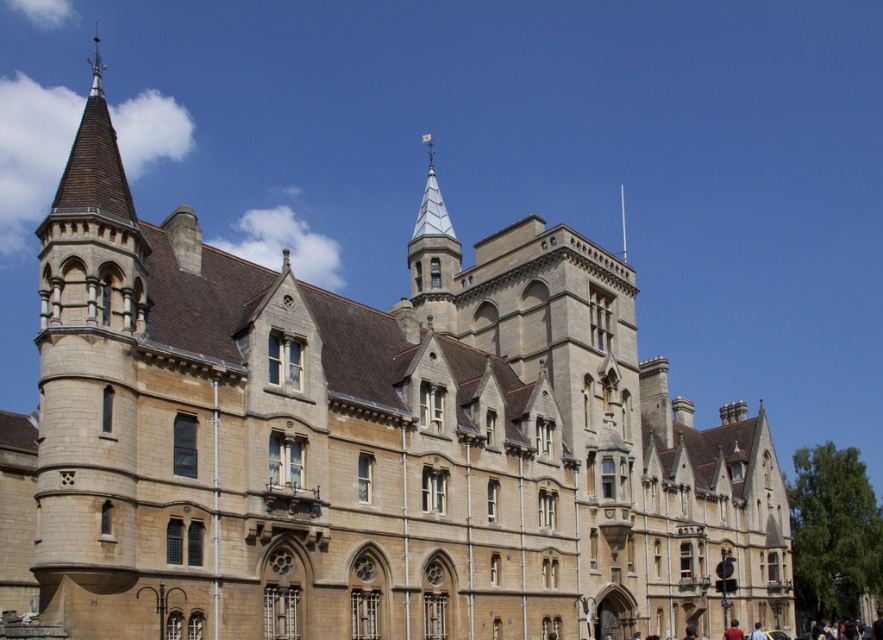
Question: Among these points, which one is nearest to the camera?

Choices:
 (A) (425, 198)
 (B) (730, 637)
 (C) (759, 637)

Answer: (C)

Question: Does red fabric person at lower right have a smaller size compared to blurred yellow shirt at lower right?

Choices:
 (A) no
 (B) yes

Answer: (B)

Question: Does white glass spire at upper center have a lesser width compared to red fabric person at lower right?

Choices:
 (A) no
 (B) yes

Answer: (A)

Question: Is red fabric person at lower right below blurred yellow shirt at lower right?

Choices:
 (A) yes
 (B) no

Answer: (B)

Question: Which point is closer to the camera taking this photo?

Choices:
 (A) (738, 634)
 (B) (435, 276)

Answer: (A)

Question: Which of the following is the closest to the observer?

Choices:
 (A) white glass spire at upper center
 (B) red fabric person at lower right
 (C) blurred yellow shirt at lower right

Answer: (B)